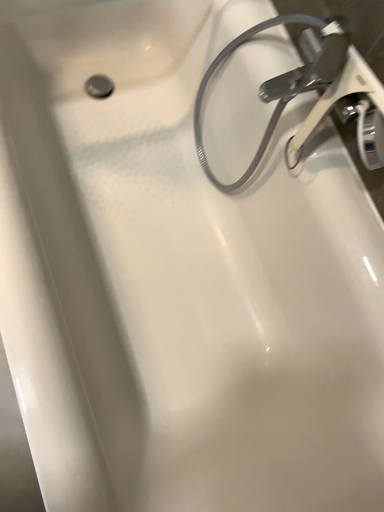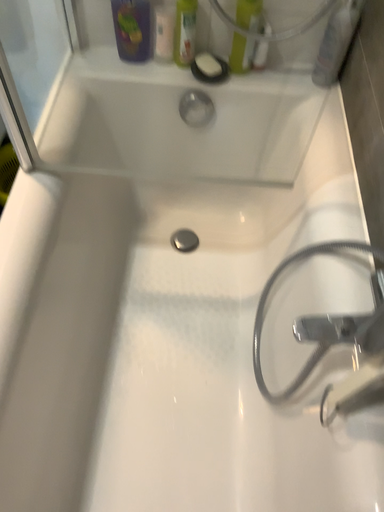
Question: How did the camera likely rotate when shooting the video?

Choices:
 (A) rotated left
 (B) rotated right

Answer: (A)